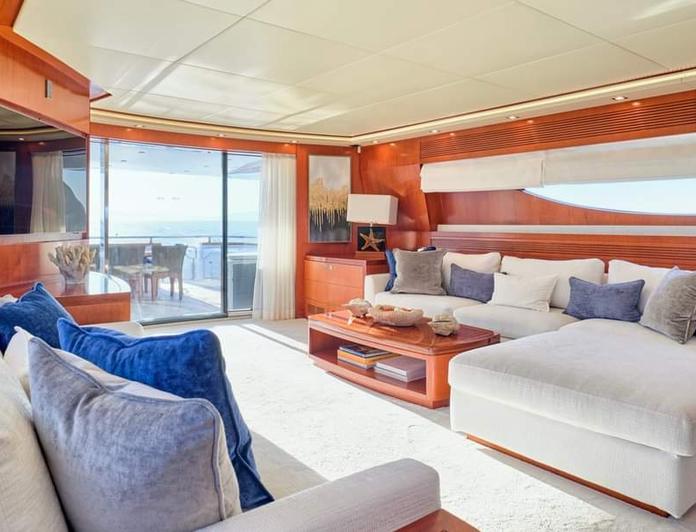
Where is `pillow`? This screenshot has width=696, height=532. pillow is located at coordinates (591, 296), (502, 286), (466, 275), (411, 267), (125, 350), (113, 426).